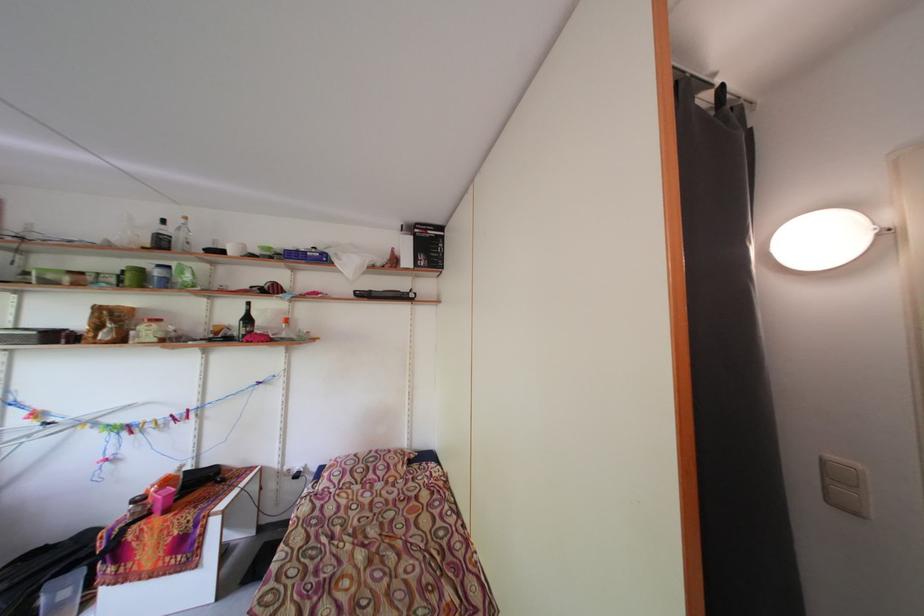
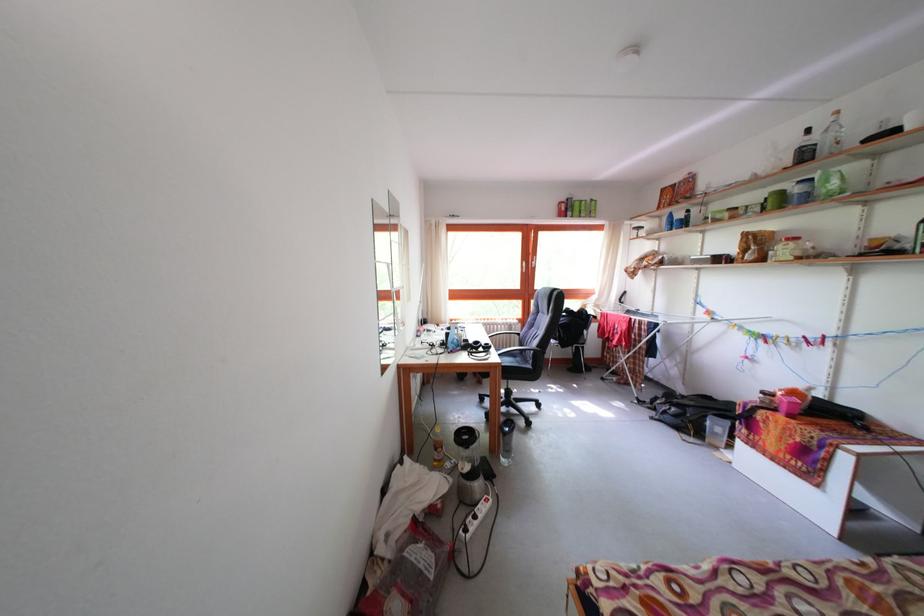
Question: The images are taken continuously from a first-person perspective. In which direction is your viewpoint rotating?

Choices:
 (A) Left
 (B) Right
 (C) Up
 (D) Down

Answer: (A)